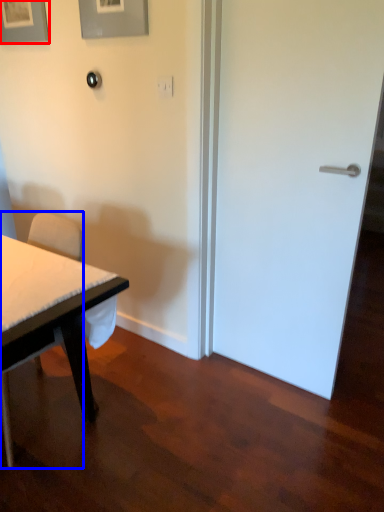
Question: Among these objects, which one is nearest to the camera, picture frame (highlighted by a red box) or chair (highlighted by a blue box)?

Choices:
 (A) picture frame
 (B) chair

Answer: (B)